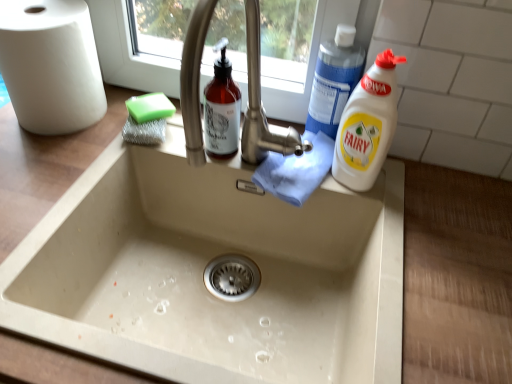
Question: Considering the positions of green sponge at upper left and white plastic bottle at right, the 2th cleaning product positioned from the top, in the image, is green sponge at upper left wider or thinner than white plastic bottle at right, the 2th cleaning product positioned from the top,?

Choices:
 (A) thin
 (B) wide

Answer: (B)

Question: Visually, is green sponge at upper left positioned to the left or to the right of white plastic bottle at right, the 1th cleaning product when ordered from bottom to top?

Choices:
 (A) right
 (B) left

Answer: (B)

Question: Which is farther from the white matte paper towel at left?

Choices:
 (A) blue plastic bottle at upper right, which is counted as the second cleaning product, starting from the bottom
 (B) white plastic bottle at right, the 1th cleaning product when ordered from bottom to top
 (C) green sponge at upper left

Answer: (B)

Question: Based on their relative distances, which object is nearer to the blue plastic bottle at upper right, which is counted as the second cleaning product, starting from the bottom?

Choices:
 (A) white matte paper towel at left
 (B) green sponge at upper left
 (C) white plastic bottle at right, the 1th cleaning product when ordered from bottom to top

Answer: (C)